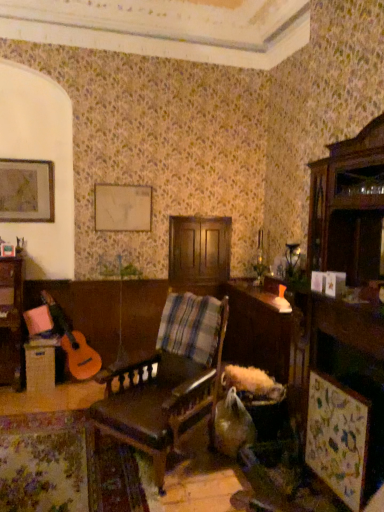
Question: Does wooden table at center, arranged as the 2th table when viewed from the left, have a lesser width compared to matte wooden picture frame at upper left?

Choices:
 (A) no
 (B) yes

Answer: (A)

Question: Is wooden table at center, the 1th table viewed from the right, next to matte wooden picture frame at upper left and touching it?

Choices:
 (A) yes
 (B) no

Answer: (B)

Question: Does wooden table at center, the 1th table viewed from the right, have a smaller size compared to matte wooden picture frame at upper left?

Choices:
 (A) yes
 (B) no

Answer: (B)

Question: Can you confirm if wooden table at center, arranged as the 2th table when viewed from the left, is shorter than matte wooden picture frame at upper left?

Choices:
 (A) yes
 (B) no

Answer: (B)

Question: From a real-world perspective, is wooden table at center, arranged as the 2th table when viewed from the left, on top of matte wooden picture frame at upper left?

Choices:
 (A) yes
 (B) no

Answer: (B)

Question: Is wooden table at center, arranged as the 2th table when viewed from the left, positioned behind matte wooden picture frame at upper left?

Choices:
 (A) yes
 (B) no

Answer: (B)

Question: Can you confirm if wooden table at center, arranged as the 2th table when viewed from the left, is wider than wooden table at lower left, which ranks as the second table in right-to-left order?

Choices:
 (A) yes
 (B) no

Answer: (A)

Question: From the image's perspective, is wooden table at center, the 1th table viewed from the right, beneath wooden table at lower left, positioned as the 1th table in left-to-right order?

Choices:
 (A) no
 (B) yes

Answer: (A)

Question: Considering the relative positions of wooden table at center, arranged as the 2th table when viewed from the left, and wooden table at lower left, positioned as the 1th table in left-to-right order, in the image provided, is wooden table at center, arranged as the 2th table when viewed from the left, behind wooden table at lower left, positioned as the 1th table in left-to-right order,?

Choices:
 (A) no
 (B) yes

Answer: (A)

Question: From a real-world perspective, is wooden table at center, the 1th table viewed from the right, on top of wooden table at lower left, which ranks as the second table in right-to-left order?

Choices:
 (A) no
 (B) yes

Answer: (B)

Question: Is wooden table at center, arranged as the 2th table when viewed from the left, outside of wooden table at lower left, which ranks as the second table in right-to-left order?

Choices:
 (A) yes
 (B) no

Answer: (A)

Question: Does wooden table at center, arranged as the 2th table when viewed from the left, have a lesser width compared to wooden table at lower left, which ranks as the second table in right-to-left order?

Choices:
 (A) no
 (B) yes

Answer: (A)

Question: From a real-world perspective, is wooden table at lower left, positioned as the 1th table in left-to-right order, positioned under matte wooden picture frame at upper left based on gravity?

Choices:
 (A) yes
 (B) no

Answer: (A)